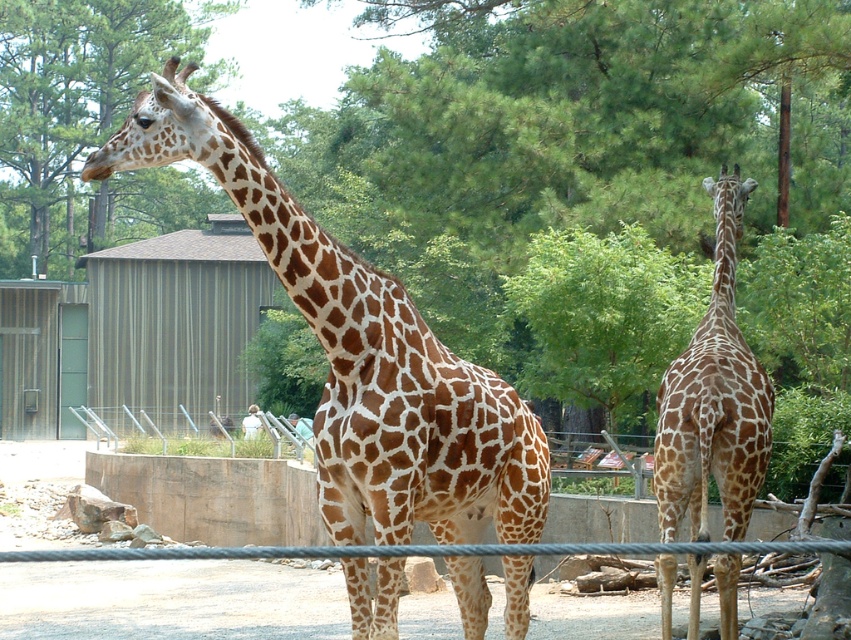
You are standing in front of the zoo enclosure looking at the two giraffes. There is a point marked at coordinates (712, 397). Which giraffe does this point belong to?

The point marked at coordinates (712, 397) is on the brown spotted giraffe at right.

You are a zoo visitor standing behind the concrete barrier. You want to take a photo of the brown spotted giraffe at right without including the green leafy tree at upper center in the background. Is it possible to do so by moving closer to the giraffe?

The green leafy tree at upper center is much taller than the brown spotted giraffe at right. Since the tree is taller, moving closer to the giraffe might still keep the tree visible in the background unless you position yourself far enough to the side or lower your camera angle to exclude it. However, without specific spatial details like distance between them, it is uncertain. But based on height difference alone, if the tree is behind and taller, it might still show. Maybe the answer should be no? Wait, I

You are standing in front of the zoo enclosure looking at the green leafy tree at upper center and the brown spotted giraffe at right. Which object is positioned to the left of the other?

The green leafy tree at upper center is positioned to the left of the brown spotted giraffe at right.